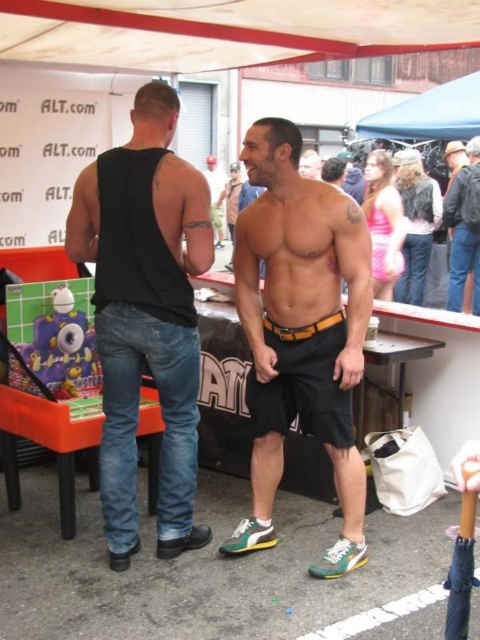
Between black denim jeans at left and smooth skin torso at center, which one appears on the right side from the viewer's perspective?

smooth skin torso at center is more to the right.

You are a GUI agent. You are given a task and a screenshot of the screen. Output one action in this format:
    pyautogui.click(x=<x>, y=<y>)
    Task: Click on the black denim jeans at left
    
    Given the screenshot: What is the action you would take?
    tap(145, 314)

Is point (135, 288) positioned in front of point (313, 172)?

Yes.

Where is `black denim jeans at left`? black denim jeans at left is located at coordinates (145, 314).

How much distance is there between shiny metallic belt at center and orange leather belt at center?

22.20 feet

Who is more distant from viewer, (226, 177) or (267, 317)?

The point (226, 177) is more distant.

I want to click on shiny metallic belt at center, so coord(216,196).

Can you confirm if black matte shorts at center is smaller than orange leather belt at center?

Incorrect, black matte shorts at center is not smaller in size than orange leather belt at center.

Is black matte shorts at center further to the viewer compared to orange leather belt at center?

That is False.

Does point (286, 188) lie behind point (266, 326)?

No, (286, 188) is closer to viewer.

You are a GUI agent. You are given a task and a screenshot of the screen. Output one action in this format:
    pyautogui.click(x=<x>, y=<y>)
    Task: Click on the black matte shorts at center
    Image resolution: width=480 pixels, height=640 pixels.
    Given the screenshot: What is the action you would take?
    pyautogui.click(x=298, y=326)